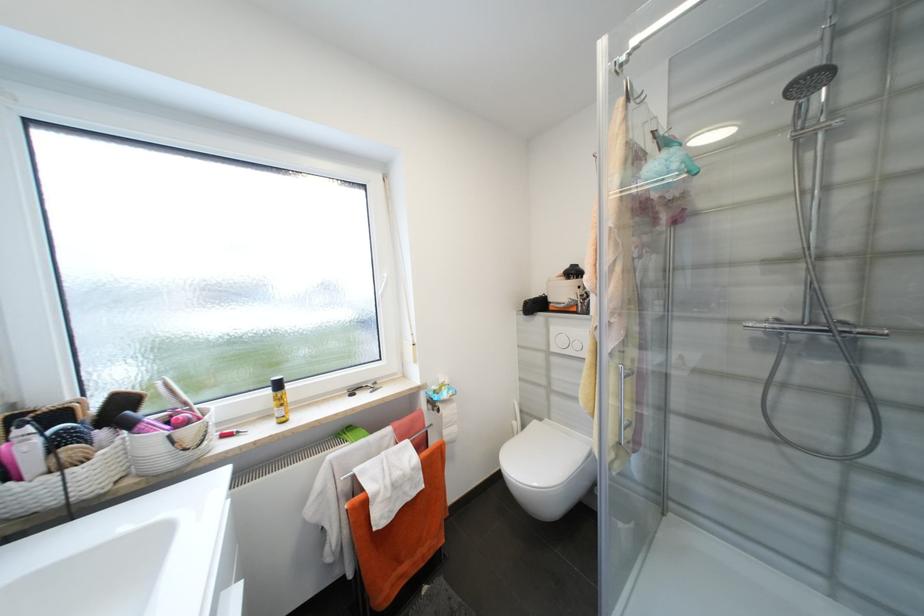
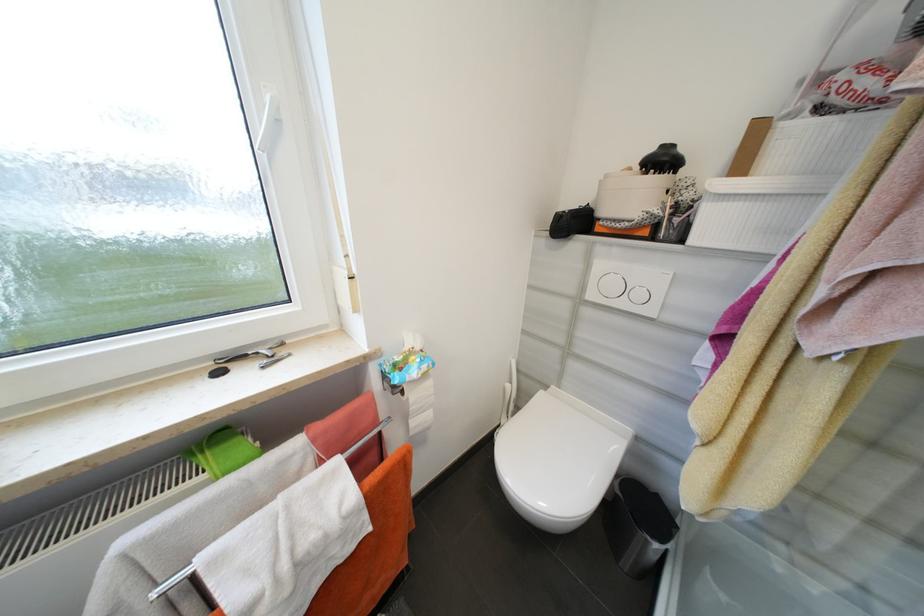
Where in the second image is the point corresponding to (520,424) from the first image?

(514, 387)